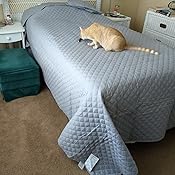
Locate an element on the screen. blanket is located at coordinates (102, 115).